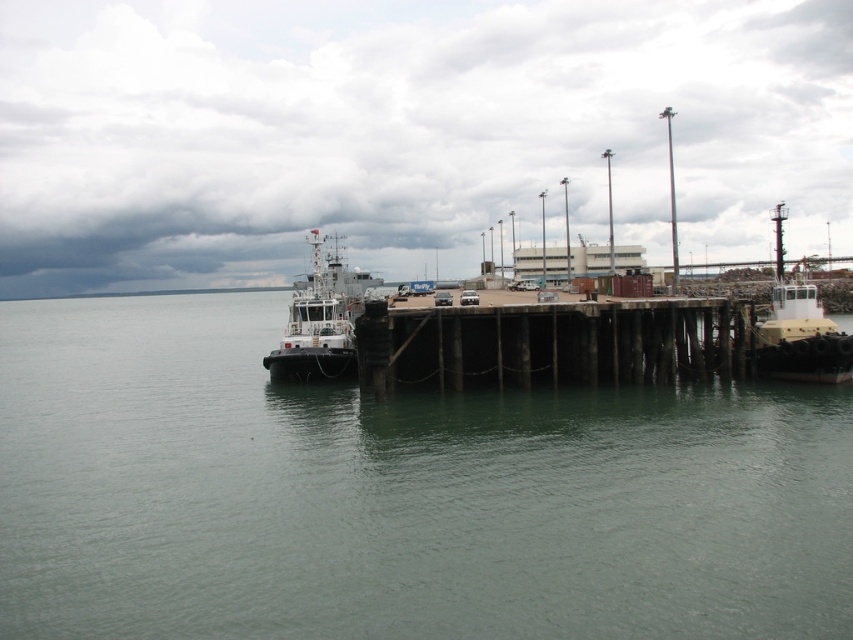
Question: Does greenish water at center appear on the right side of brown wooden dock at center?

Choices:
 (A) no
 (B) yes

Answer: (B)

Question: Which of the following is the closest to the observer?

Choices:
 (A) white glossy tugboat at left
 (B) greenish water at center

Answer: (B)

Question: Which point is farther to the camera?

Choices:
 (A) white glossy tugboat at left
 (B) greenish water at center
 (C) brown wooden dock at center

Answer: (A)

Question: Considering the relative positions of brown wooden dock at center and white glossy tugboat at left in the image provided, where is brown wooden dock at center located with respect to white glossy tugboat at left?

Choices:
 (A) left
 (B) right

Answer: (B)

Question: Which object is closer to the camera taking this photo?

Choices:
 (A) white glossy tugboat at left
 (B) greenish water at center
 (C) brown wooden dock at center

Answer: (B)

Question: Does greenish water at center appear on the right side of white glossy tugboat at left?

Choices:
 (A) no
 (B) yes

Answer: (B)